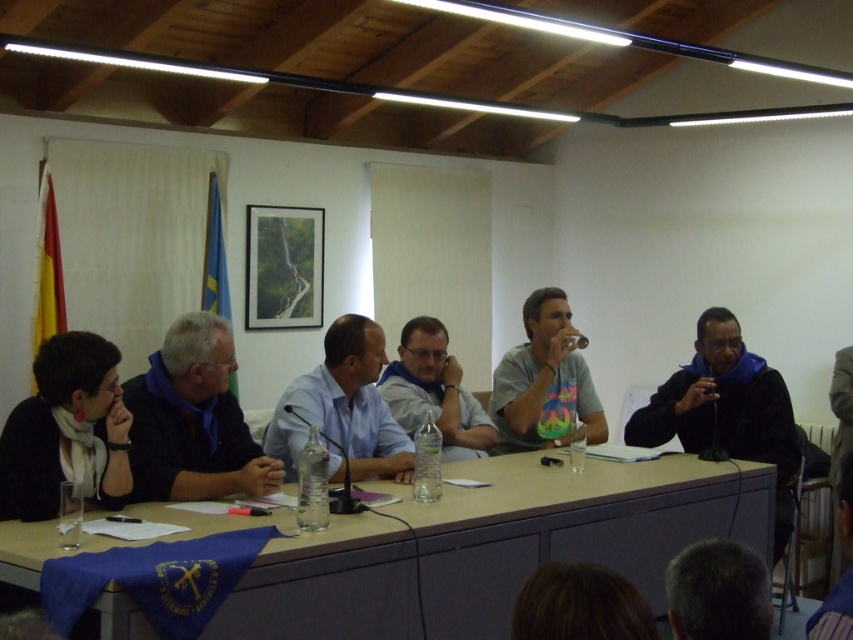
Find the location of a particular element. brown wood table at center is located at coordinates (572, 528).

Is point (30, 576) closer to viewer compared to point (727, 324)?

Yes, it is in front of point (727, 324).

Describe the element at coordinates (572, 528) in the screenshot. I see `brown wood table at center` at that location.

Locate an element on the screen. The height and width of the screenshot is (640, 853). brown wood table at center is located at coordinates (572, 528).

Does point (288, 586) come closer to viewer compared to point (76, 392)?

Yes, it is.

Does brown wood table at center have a larger size compared to white scarf at left?

Yes.

Does point (306, 557) come behind point (111, 499)?

No, it is not.

The height and width of the screenshot is (640, 853). I want to click on brown wood table at center, so [572, 528].

Is brown wood table at center positioned at the back of blue fabric at left?

No, it is in front of blue fabric at left.

Does brown wood table at center appear under blue fabric at left?

Yes, brown wood table at center is below blue fabric at left.

Does point (686, 516) lie behind point (264, 474)?

Yes, point (686, 516) is behind point (264, 474).

Image resolution: width=853 pixels, height=640 pixels. Find the location of `brown wood table at center`. brown wood table at center is located at coordinates (572, 528).